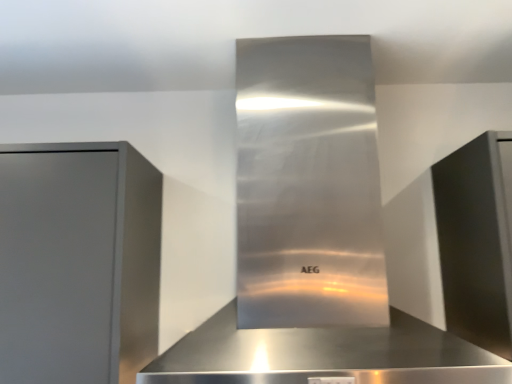
Describe the element at coordinates (313, 238) in the screenshot. I see `stainless steel range hood at center` at that location.

This screenshot has width=512, height=384. Identify the location of stainless steel range hood at center. (313, 238).

The width and height of the screenshot is (512, 384). I want to click on stainless steel range hood at center, so click(x=313, y=238).